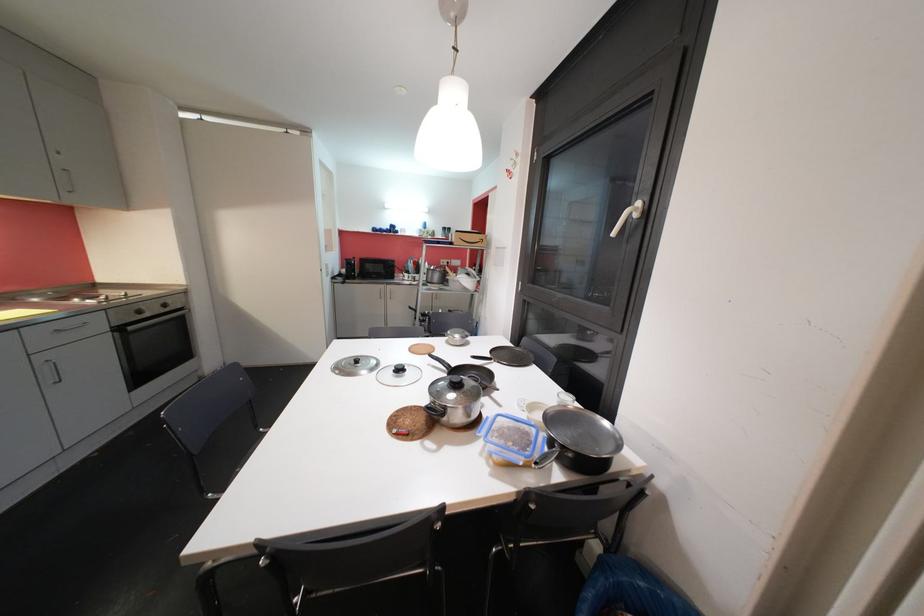
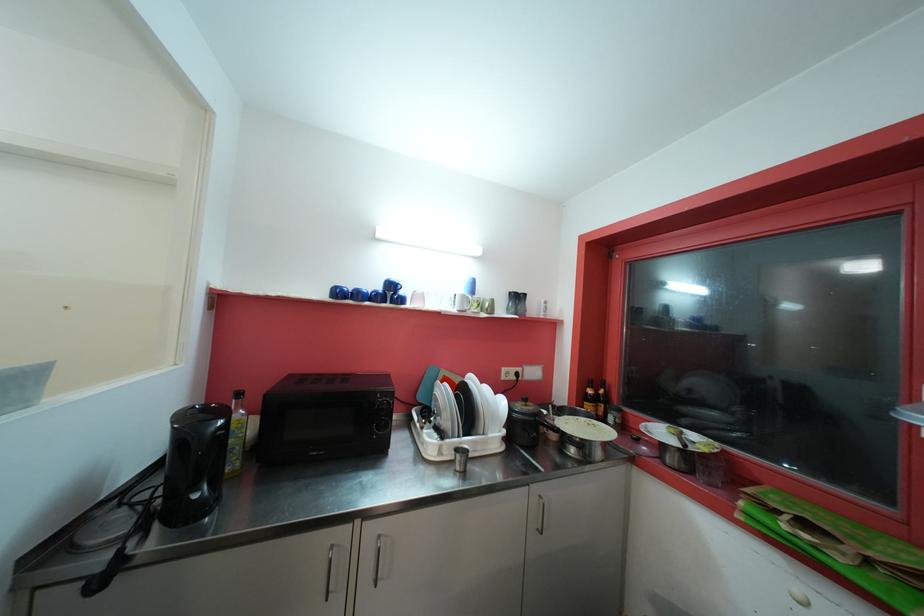
Question: In a continuous first-person perspective shot, in which direction is the camera moving?

Choices:
 (A) Left
 (B) Right
 (C) Forward
 (D) Backward

Answer: (C)